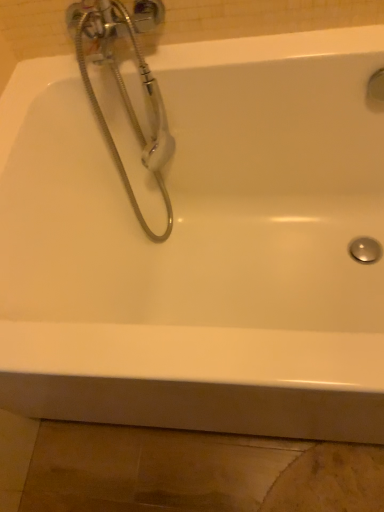
Locate an element on the screen. This screenshot has width=384, height=512. chrome metallic shower head at upper left is located at coordinates (124, 84).

What is the approximate width of chrome metallic shower head at upper left?

11.23 inches.

Measure the distance between chrome metallic shower head at upper left and camera.

The depth of chrome metallic shower head at upper left is 31.02 inches.

This screenshot has height=512, width=384. What do you see at coordinates (124, 84) in the screenshot? I see `chrome metallic shower head at upper left` at bounding box center [124, 84].

Identify the location of chrome metallic shower head at upper left. (124, 84).